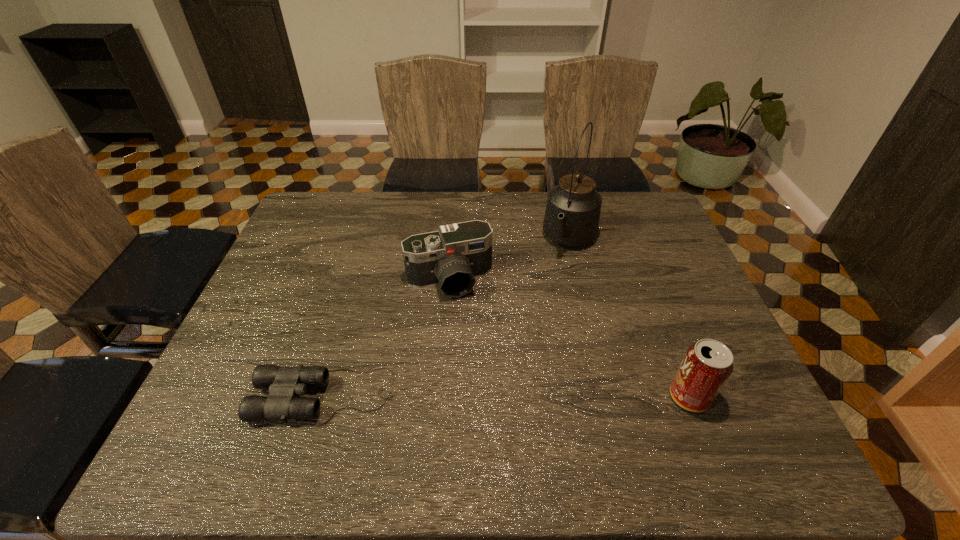
The height and width of the screenshot is (540, 960). I want to click on vacant space located 0.340m spout on the second object from right to left, so pos(520,345).

Where is `blank space located 0.120m spout on the second object from right to left`? Image resolution: width=960 pixels, height=540 pixels. blank space located 0.120m spout on the second object from right to left is located at coordinates (549, 287).

Identify the location of vacant space located 0.320m spout on the second object from right to left. This screenshot has width=960, height=540. (523, 339).

Locate an element on the screen. The width and height of the screenshot is (960, 540). object that is at the far edge is located at coordinates (572, 214).

Where is `binoculars that is at the near edge`? binoculars that is at the near edge is located at coordinates (284, 383).

Locate an element on the screen. soda can situated at the near edge is located at coordinates (707, 365).

Where is `object that is at the left edge`? The image size is (960, 540). object that is at the left edge is located at coordinates (284, 383).

Locate an element on the screen. This screenshot has height=540, width=960. object positioned at the right edge is located at coordinates (707, 365).

Identify the location of object that is positioned at the near left corner. point(284,383).

The height and width of the screenshot is (540, 960). Identify the location of object located at the near right corner. (707, 365).